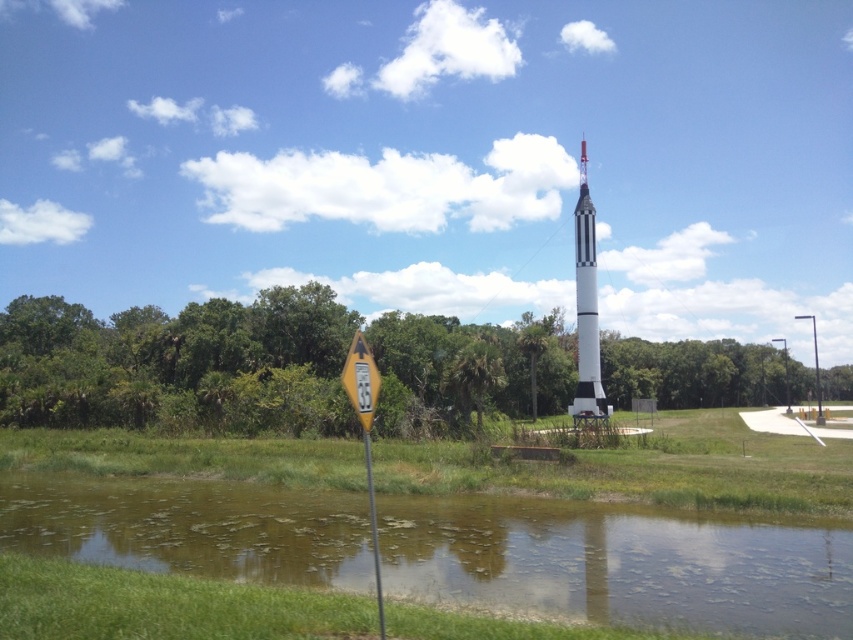
Question: Estimate the real-world distances between objects in this image. Which object is closer to the white matte rocket at center?

Choices:
 (A) yellow plastic pole at center
 (B) green grassy water at lower center

Answer: (B)

Question: Where is yellow reflective plastic at left located in relation to yellow reflective plastic road sign at lower center in the image?

Choices:
 (A) left
 (B) right

Answer: (B)

Question: Which of the following is the closest to the observer?

Choices:
 (A) (351, 401)
 (B) (345, 362)

Answer: (A)

Question: Is the position of green grassy water at lower center more distant than that of yellow reflective plastic road sign at lower center?

Choices:
 (A) no
 (B) yes

Answer: (B)

Question: Which point is closer to the camera?

Choices:
 (A) yellow plastic pole at center
 (B) yellow reflective plastic at left
 (C) white matte rocket at center
 (D) yellow reflective plastic road sign at lower center

Answer: (D)

Question: From the image, what is the correct spatial relationship of white matte rocket at center in relation to yellow reflective plastic road sign at lower center?

Choices:
 (A) right
 (B) left

Answer: (A)